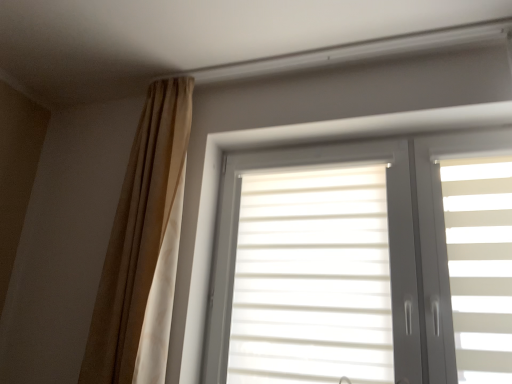
Question: Is white matte window at center facing towards beige fabric curtain at upper left?

Choices:
 (A) no
 (B) yes

Answer: (A)

Question: Does white matte window at center lie in front of beige fabric curtain at upper left?

Choices:
 (A) yes
 (B) no

Answer: (A)

Question: From a real-world perspective, is white matte window at center physically below beige fabric curtain at upper left?

Choices:
 (A) yes
 (B) no

Answer: (A)

Question: From the image's perspective, is white matte window at center under beige fabric curtain at upper left?

Choices:
 (A) no
 (B) yes

Answer: (B)

Question: Is white matte window at center smaller than beige fabric curtain at upper left?

Choices:
 (A) yes
 (B) no

Answer: (B)

Question: Are white matte window at center and beige fabric curtain at upper left located far from each other?

Choices:
 (A) yes
 (B) no

Answer: (B)

Question: From a real-world perspective, does beige fabric curtain at upper left stand above white matte window at center?

Choices:
 (A) yes
 (B) no

Answer: (A)

Question: Does beige fabric curtain at upper left have a smaller size compared to white matte window at center?

Choices:
 (A) no
 (B) yes

Answer: (B)

Question: Can we say beige fabric curtain at upper left lies outside white matte window at center?

Choices:
 (A) yes
 (B) no

Answer: (A)

Question: From the image's perspective, would you say beige fabric curtain at upper left is shown under white matte window at center?

Choices:
 (A) no
 (B) yes

Answer: (A)

Question: Considering the relative positions of beige fabric curtain at upper left and white matte window at center in the image provided, is beige fabric curtain at upper left behind white matte window at center?

Choices:
 (A) yes
 (B) no

Answer: (A)

Question: Does beige fabric curtain at upper left appear on the right side of white matte window at center?

Choices:
 (A) no
 (B) yes

Answer: (A)

Question: Would you say beige fabric curtain at upper left is to the left or to the right of white matte window at center in the picture?

Choices:
 (A) right
 (B) left

Answer: (B)